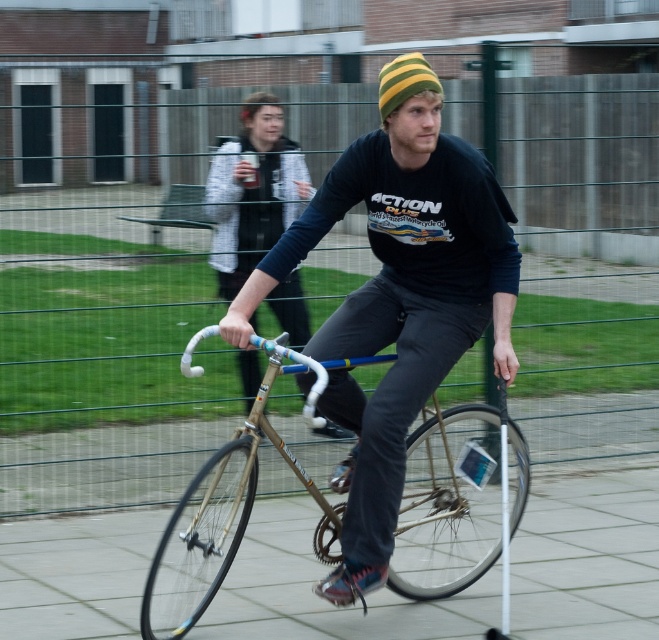
Who is shorter, matte black bicycle at center or striped knit beanie at center?

With less height is striped knit beanie at center.

Between matte black bicycle at center and striped knit beanie at center, which one appears on the right side from the viewer's perspective?

striped knit beanie at center is more to the right.

Who is more forward, [214,266] or [413,88]?

Point [413,88] is in front.

At what (x,y) coordinates should I click in order to perform the action: click on matte black bicycle at center. Please return your answer as a coordinate pair (x, y). Looking at the image, I should click on (252, 189).

Does smooth concrete pavement at center have a greater height compared to matte black bicycle at center?

Incorrect, smooth concrete pavement at center's height is not larger of matte black bicycle at center's.

Is smooth concrete pavement at center thinner than matte black bicycle at center?

No.

Which is in front, point (378, 596) or point (273, 186)?

Point (378, 596)

Locate an element on the screen. The width and height of the screenshot is (659, 640). smooth concrete pavement at center is located at coordinates (587, 554).

Does point (416, 339) come behind point (422, 76)?

Yes, it is.

How distant is matte gold bicycle at center from striped knit beanie at center?

matte gold bicycle at center and striped knit beanie at center are 3.32 feet apart from each other.

Where is `matte gold bicycle at center`? matte gold bicycle at center is located at coordinates (397, 307).

I want to click on matte gold bicycle at center, so click(x=397, y=307).